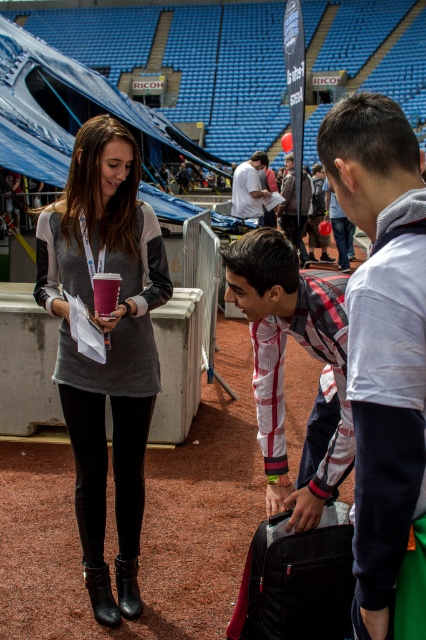
Question: Which object is positioned closest to the plaid fabric shirt at center?

Choices:
 (A) black fabric suitcase at lower right
 (B) dark gray hoodie at right

Answer: (A)

Question: Which point is closer to the camera?

Choices:
 (A) (414, 472)
 (B) (97, 552)
 (C) (259, 616)

Answer: (A)

Question: Can you confirm if white cotton shirt at center is positioned to the right of light brown leather jacket at center?

Choices:
 (A) no
 (B) yes

Answer: (A)

Question: Among these points, which one is farthest from the camera?

Choices:
 (A) (256, 198)
 (B) (255, 612)

Answer: (A)

Question: Is gray matte sweater at center closer to camera compared to white cotton shirt at center?

Choices:
 (A) yes
 (B) no

Answer: (A)

Question: Can you confirm if dark gray hoodie at right is positioned below gray matte sweater at center?

Choices:
 (A) no
 (B) yes

Answer: (A)